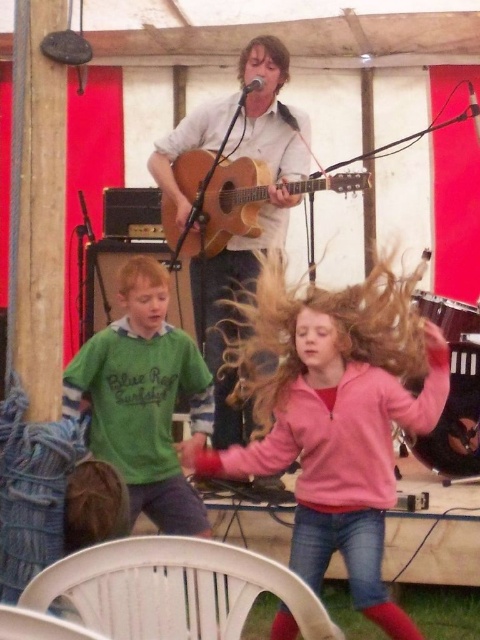
Is blonde silky hair at center positioned behind blonde silky hair at lower left?

No, blonde silky hair at center is closer to the viewer.

Does blonde silky hair at center lie in front of blonde silky hair at lower left?

Yes, it is in front of blonde silky hair at lower left.

The image size is (480, 640). What do you see at coordinates (327, 316) in the screenshot? I see `blonde silky hair at center` at bounding box center [327, 316].

Find the location of `blonde silky hair at center`. blonde silky hair at center is located at coordinates (327, 316).

Which is above, green matte shirt at left or wooden acoustic guitar at center?

wooden acoustic guitar at center

Between point (141, 291) and point (197, 312), which one is positioned behind?

The point (197, 312) is behind.

In order to click on green matte shirt at left in this screenshot , I will do `click(144, 400)`.

Which is below, acoustic wood guitar at center or blonde silky hair at lower left?

Positioned lower is blonde silky hair at lower left.

Can you confirm if acoustic wood guitar at center is wider than blonde silky hair at lower left?

Correct, the width of acoustic wood guitar at center exceeds that of blonde silky hair at lower left.

Between point (165, 209) and point (142, 280), which one is positioned behind?

Point (165, 209)

This screenshot has height=640, width=480. I want to click on acoustic wood guitar at center, so click(x=216, y=202).